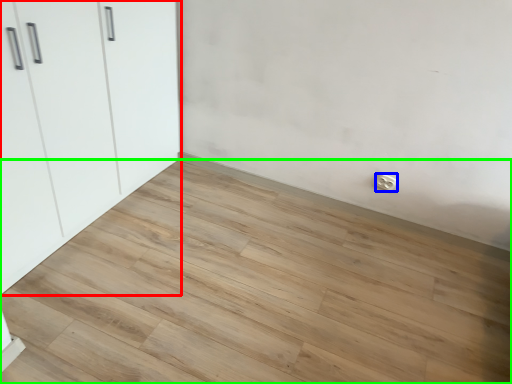
Question: Considering the real-world distances, which object is farthest from cupboard (highlighted by a red box)? electric outlet (highlighted by a blue box) or plank (highlighted by a green box)?

Choices:
 (A) electric outlet
 (B) plank

Answer: (A)